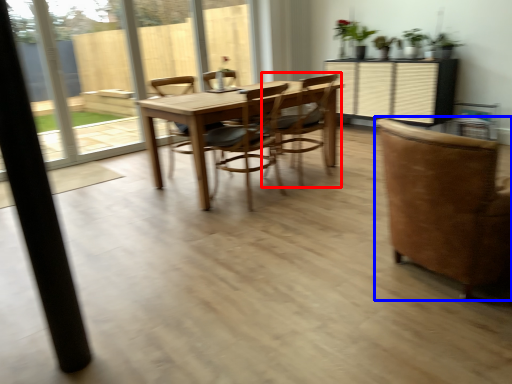
Question: Among these objects, which one is farthest to the camera, chair (highlighted by a red box) or chair (highlighted by a blue box)?

Choices:
 (A) chair
 (B) chair

Answer: (A)